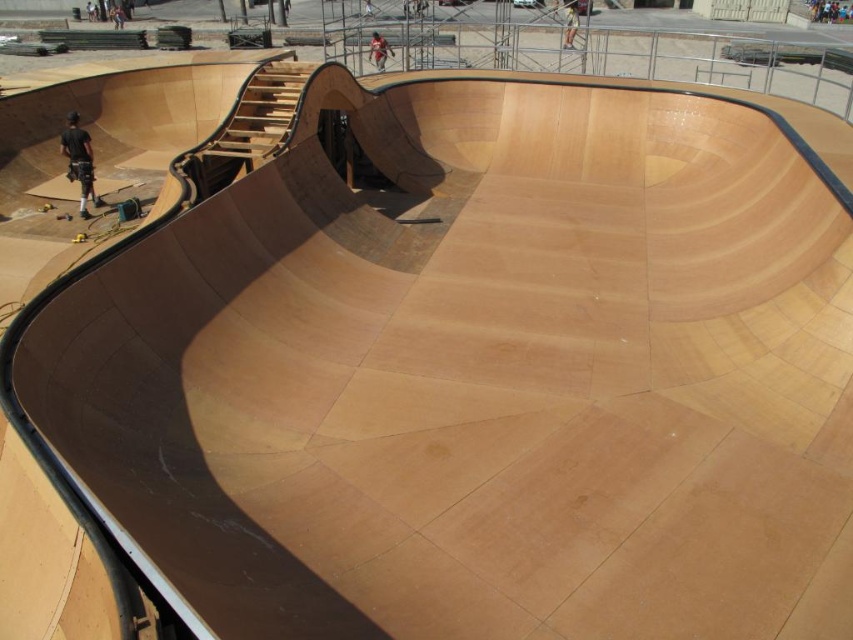
Question: From the image, what is the correct spatial relationship of black leather pants at left in relation to light brown wooden skateboard at upper center?

Choices:
 (A) right
 (B) left

Answer: (B)

Question: Can you confirm if light brown wooden skateboard at upper center is bigger than light brown wooden skateboarder at upper center?

Choices:
 (A) yes
 (B) no

Answer: (B)

Question: From the image, what is the correct spatial relationship of black leather pants at left in relation to light brown wooden skateboard at upper center?

Choices:
 (A) below
 (B) above

Answer: (A)

Question: Which point is farther to the camera?

Choices:
 (A) (569, 20)
 (B) (375, 48)

Answer: (A)

Question: Which object appears closest to the camera in this image?

Choices:
 (A) light brown wooden skateboarder at upper center
 (B) black leather pants at left
 (C) light brown wooden skateboard at upper center

Answer: (B)

Question: Which object is farther from the camera taking this photo?

Choices:
 (A) light brown wooden skateboarder at upper center
 (B) black leather pants at left
 (C) light brown wooden skateboard at upper center

Answer: (A)